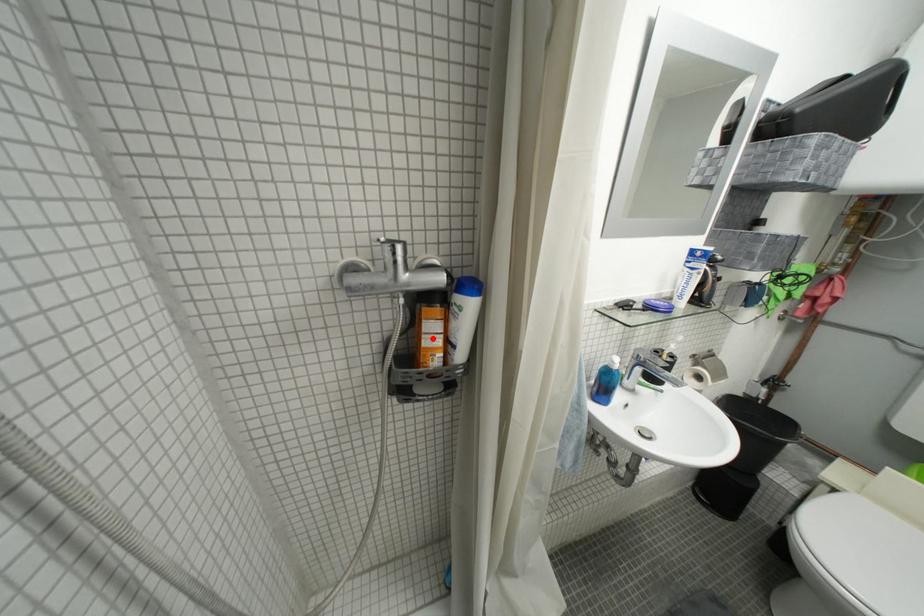
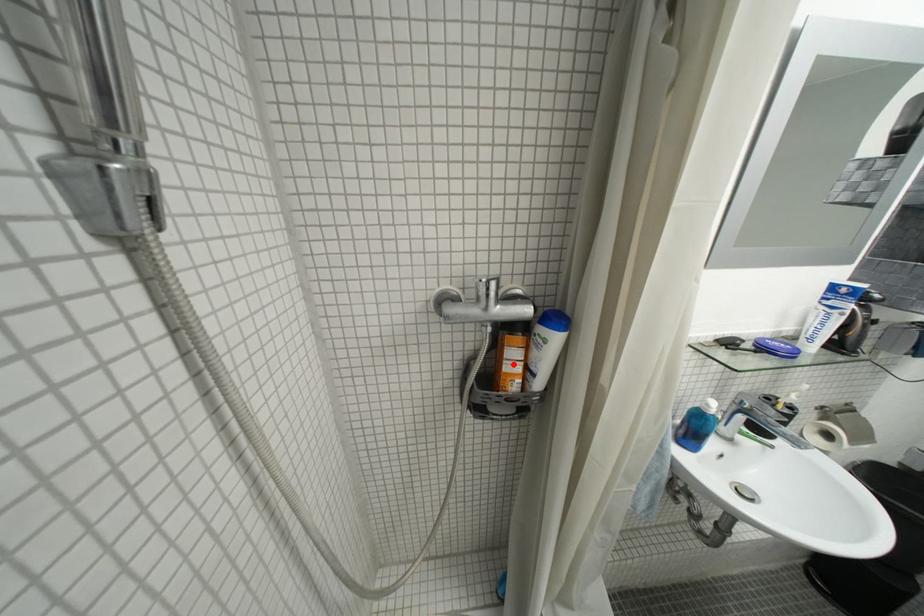
I am providing you with two images of the same scene from different viewpoints. A red point is marked on the first image and another point is marked on the second image. Do the highlighted points in image1 and image2 indicate the same real-world spot?

Yes